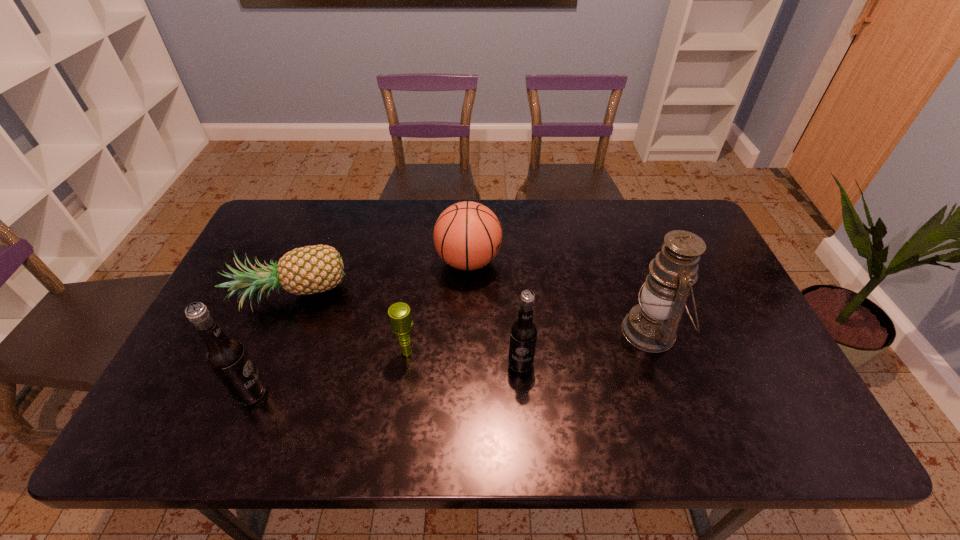
The height and width of the screenshot is (540, 960). Find the location of `the nearer root beer`. the nearer root beer is located at coordinates (226, 357).

You are a GUI agent. You are given a task and a screenshot of the screen. Output one action in this format:
    pyautogui.click(x=<x>, y=<y>)
    Task: Click on the nearest object
    
    Given the screenshot: What is the action you would take?
    pyautogui.click(x=226, y=357)

Locate an element on the screen. The height and width of the screenshot is (540, 960). the second object from right to left is located at coordinates (523, 333).

Identify the location of the shorter root beer. The height and width of the screenshot is (540, 960). (523, 333).

This screenshot has height=540, width=960. Find the location of `basketball`. basketball is located at coordinates pyautogui.click(x=467, y=235).

Where is `the third object from right to left`? the third object from right to left is located at coordinates (467, 235).

Image resolution: width=960 pixels, height=540 pixels. Find the location of `the rightmost object`. the rightmost object is located at coordinates (651, 326).

Where is `the third object from left to right`? the third object from left to right is located at coordinates (401, 322).

This screenshot has height=540, width=960. Identify the location of pineapple. (311, 269).

You are a GUI agent. You are given a task and a screenshot of the screen. Output one action in this format:
    pyautogui.click(x=<x>, y=<y>)
    Task: Click on the vacant space located 0.210m on the label of the nearest object
    Image resolution: width=960 pixels, height=540 pixels.
    Given the screenshot: What is the action you would take?
    pyautogui.click(x=356, y=393)